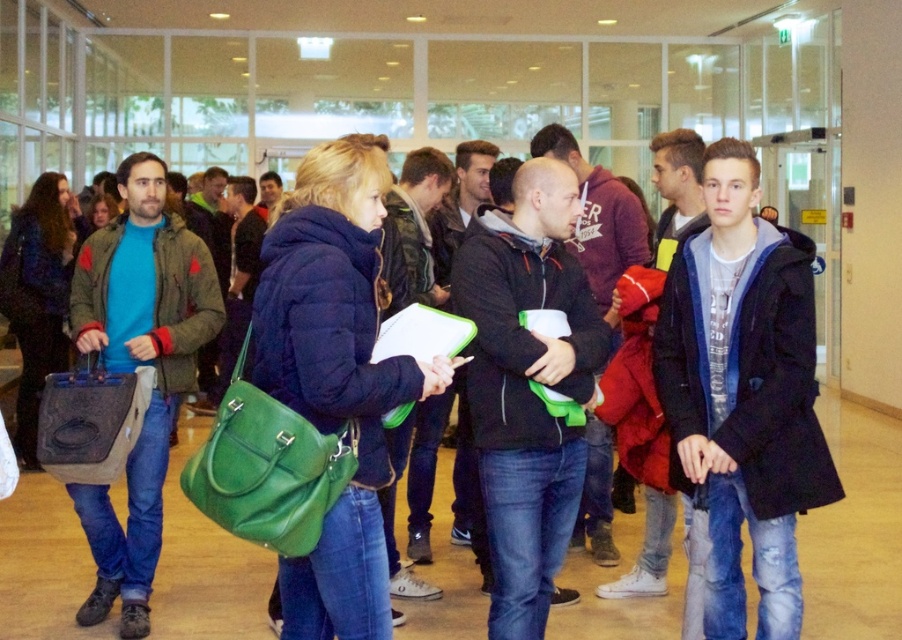
Consider the image. What are the coordinates of the dark blue textured coat at center?

The coordinates of the dark blue textured coat at center are at point (743, 394).

From the picture: You are standing in the hallway and need to place a small package between the dark blue textured coat at center and the matte green bag at center. Which object should you place the package closer to if you want it to be on the left side of the coat?

You should place the package closer to the matte green bag at center because the dark blue textured coat at center is on the right side of the matte green bag at center, so the left side of the coat would be near the bag.